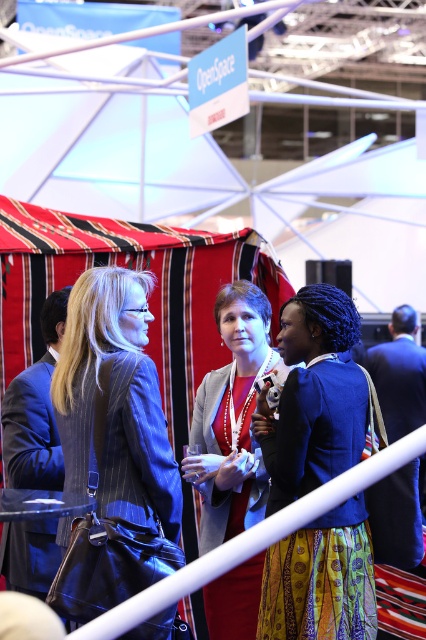
Is blue pinstripe blazer at center bigger than matte gray blazer at center?

Correct, blue pinstripe blazer at center is larger in size than matte gray blazer at center.

Image resolution: width=426 pixels, height=640 pixels. Describe the element at coordinates (112, 449) in the screenshot. I see `blue pinstripe blazer at center` at that location.

Which is in front, point (95, 468) or point (221, 468)?

Point (95, 468) is in front.

At what (x,y) coordinates should I click in order to perform the action: click on blue pinstripe blazer at center. Please return your answer as a coordinate pair (x, y). The width and height of the screenshot is (426, 640). Looking at the image, I should click on (112, 449).

Can you confirm if blue pinstripe blazer at center is bigger than blue fabric jacket at center?

Indeed, blue pinstripe blazer at center has a larger size compared to blue fabric jacket at center.

Locate an element on the screen. This screenshot has height=640, width=426. blue pinstripe blazer at center is located at coordinates (112, 449).

Identify the location of blue pinstripe blazer at center. This screenshot has height=640, width=426. (112, 449).

Is blue fabric jacket at center taller than matte gray blazer at center?

In fact, blue fabric jacket at center may be shorter than matte gray blazer at center.

Does point (331, 636) come behind point (233, 305)?

No, (331, 636) is closer to viewer.

Identify the location of blue fabric jacket at center. This screenshot has width=426, height=640. (313, 396).